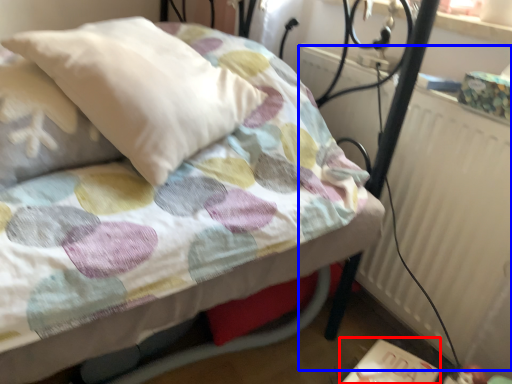
Question: Which object is closer to the camera taking this photo, table (highlighted by a red box) or radiator (highlighted by a blue box)?

Choices:
 (A) table
 (B) radiator

Answer: (B)